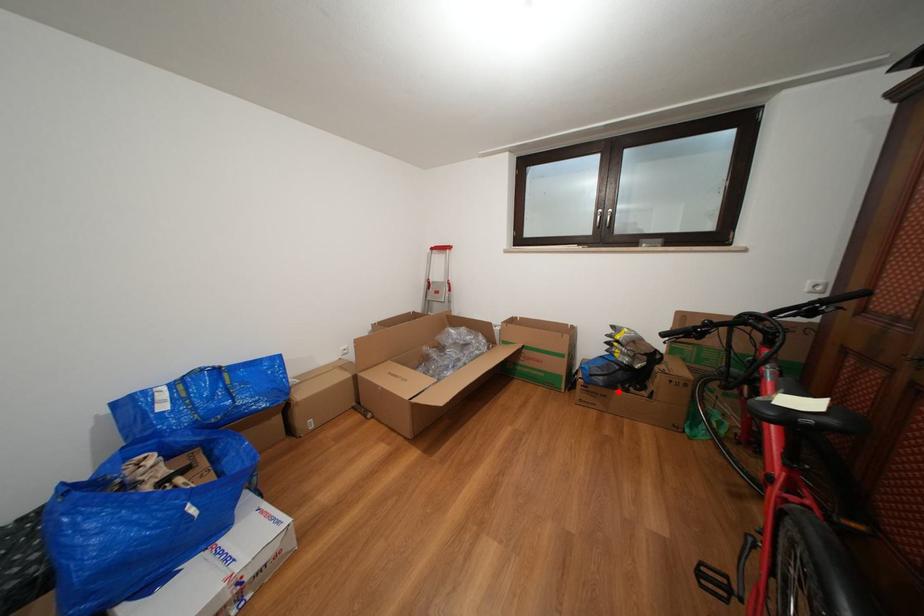
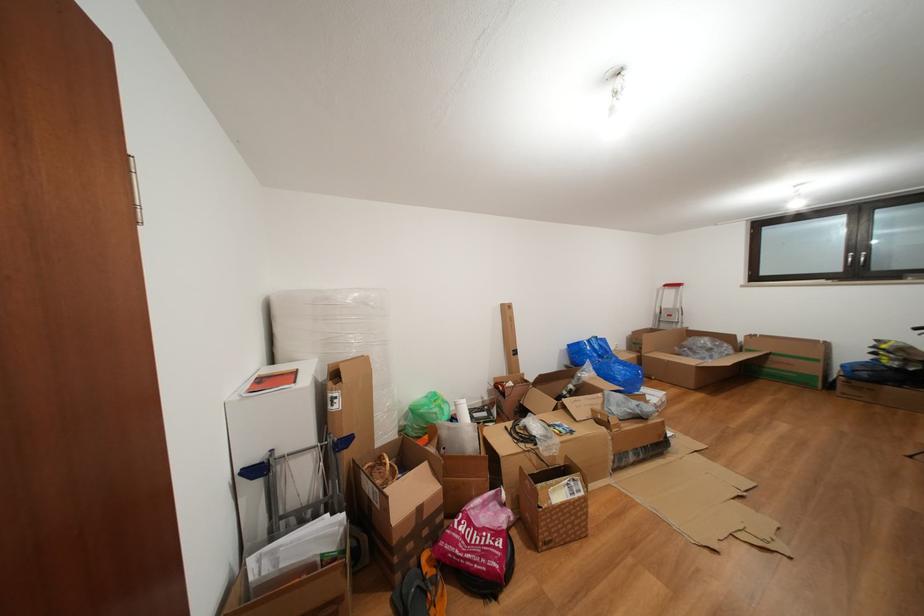
Locate, in the second image, the point that corresponds to the highlighted location in the first image.

(886, 387)